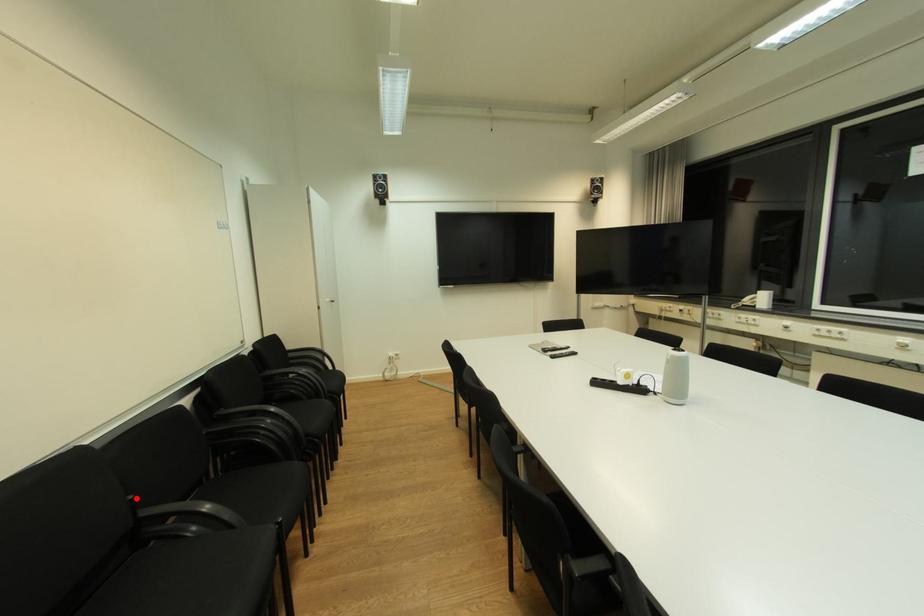
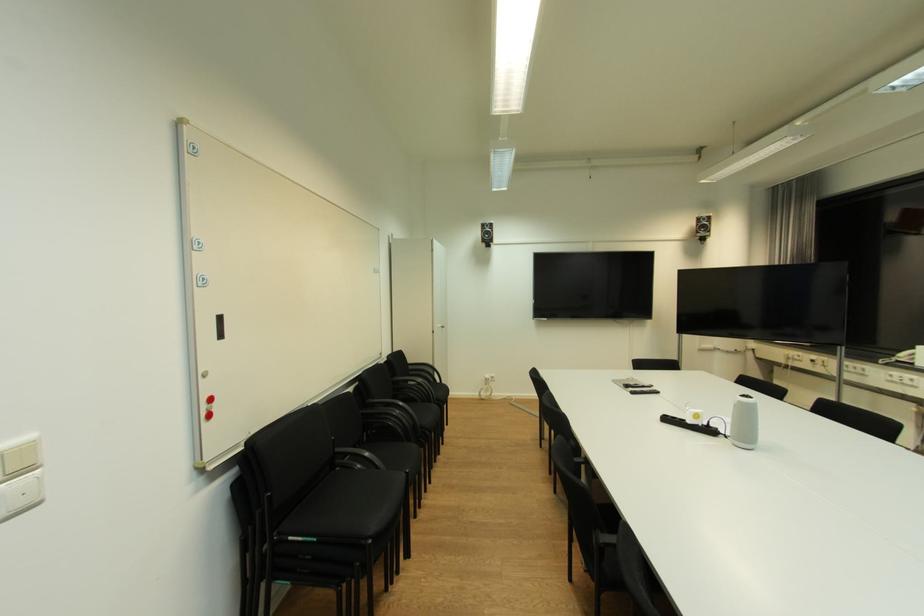
Question: I am providing you with two images of the same scene from different viewpoints. A red point is shown in image1. For the corresponding object point in image2, is it positioned nearer or farther from the camera?

Choices:
 (A) Nearer
 (B) Farther

Answer: (A)